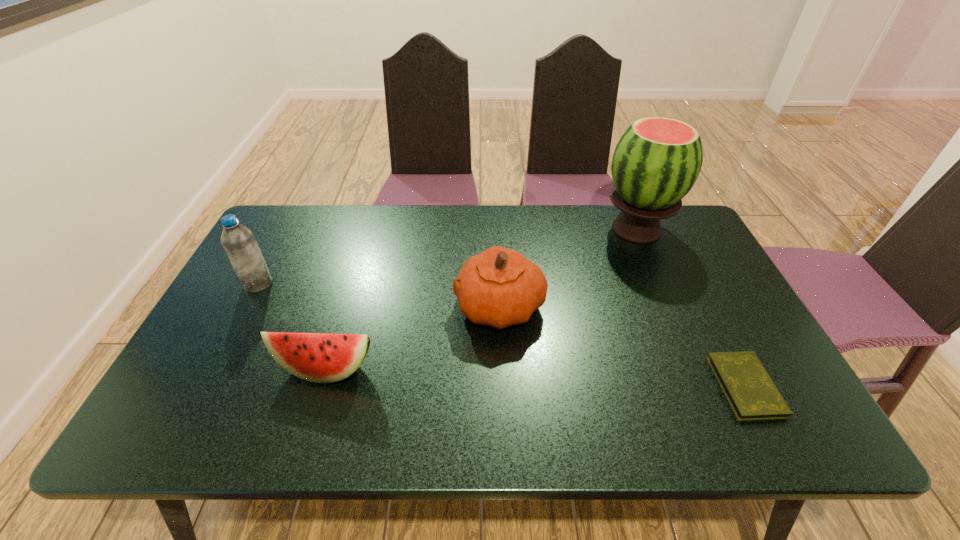
The image size is (960, 540). In order to click on free space between the shortest object and the right watermelon in this screenshot , I will do `click(691, 308)`.

Locate an element on the screen. empty location between the third shortest object and the shortest object is located at coordinates (623, 347).

Locate an element on the screen. The width and height of the screenshot is (960, 540). empty location between the third shortest object and the water bottle is located at coordinates (379, 295).

You are a GUI agent. You are given a task and a screenshot of the screen. Output one action in this format:
    pyautogui.click(x=<x>, y=<y>)
    Task: Click on the vacant space in between the shortest object and the water bottle
    The width and height of the screenshot is (960, 540).
    Given the screenshot: What is the action you would take?
    pyautogui.click(x=502, y=335)

At what (x,y) coordinates should I click in order to perform the action: click on empty space between the pumpkin and the second tallest object. Please return your answer as a coordinate pair (x, y). Looking at the image, I should click on (379, 295).

Identify the location of unoccupied area between the third tallest object and the shorter watermelon. (413, 338).

The height and width of the screenshot is (540, 960). In order to click on vacant area between the farther watermelon and the shortest object in this screenshot , I will do (x=691, y=308).

Find the location of a particular element. The height and width of the screenshot is (540, 960). vacant region between the pumpkin and the water bottle is located at coordinates (379, 295).

The width and height of the screenshot is (960, 540). What are the coordinates of `unoccupied area between the third object from right to left and the farthest object` in the screenshot? It's located at (568, 268).

The width and height of the screenshot is (960, 540). Find the location of `object that is the third nearest to the second shortest object`. object that is the third nearest to the second shortest object is located at coordinates (656, 162).